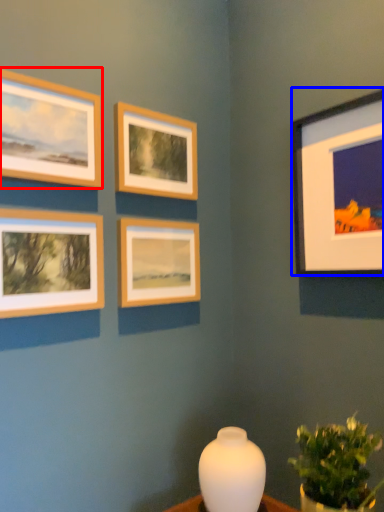
Question: Which object appears farthest to the camera in this image, picture frame (highlighted by a red box) or picture frame (highlighted by a blue box)?

Choices:
 (A) picture frame
 (B) picture frame

Answer: (B)